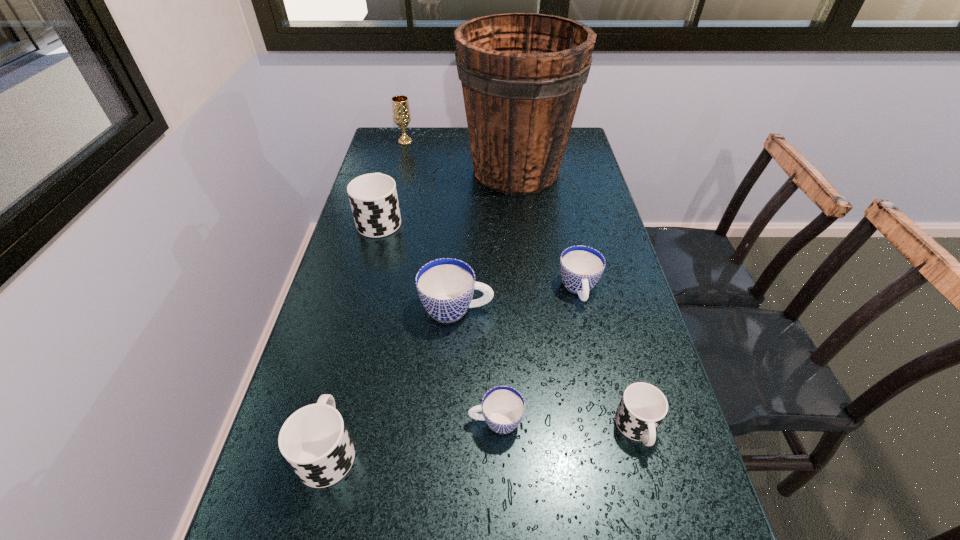
What are the coordinates of `free region located 0.400m on the front of the tallest object` in the screenshot? It's located at (530, 298).

This screenshot has height=540, width=960. Identify the location of vacant space located on the right of the second tallest object. (468, 141).

Image resolution: width=960 pixels, height=540 pixels. What are the coordinates of `free space located 0.140m on the side of the tallest cup with the handle` in the screenshot? It's located at (391, 178).

The image size is (960, 540). Identify the location of vacant area situated 0.110m on the side of the tallest cup with the handle. (390, 183).

Where is `vacant region located on the side of the tallest cup with the handle`? The height and width of the screenshot is (540, 960). vacant region located on the side of the tallest cup with the handle is located at coordinates (400, 140).

At what (x,y) coordinates should I click in order to perform the action: click on vacant space located 0.180m on the side of the biggest blue cup with the handle. Please return your answer as a coordinate pair (x, y). Looking at the image, I should click on (566, 309).

I want to click on blank space located 0.050m on the side of the second smallest black cup with the handle, so click(x=343, y=392).

Where is `free space located 0.080m on the side of the second smallest black cup with the handle`? free space located 0.080m on the side of the second smallest black cup with the handle is located at coordinates (346, 380).

You are a GUI agent. You are given a task and a screenshot of the screen. Output one action in this format:
    pyautogui.click(x=<x>, y=<y>)
    Task: Click on the free spot located 0.230m on the side of the second smallest black cup with the handle
    This screenshot has width=960, height=540.
    Given the screenshot: What is the action you would take?
    pyautogui.click(x=359, y=325)

Identify the location of free space located 0.060m on the side of the rightmost blue cup with the handle. (588, 330).